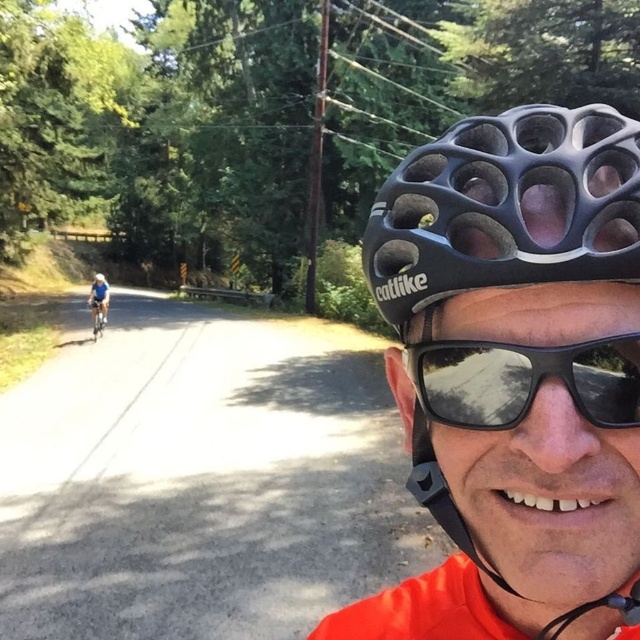
You are a delivery person who needs to park your silver metallic bicycle at center near the road. According to the scene, where exactly should you place it?

The silver metallic bicycle at center should be placed at point (97, 316) as per the coordinates provided.

You are a photographer trying to capture the person taking a selfie. You notice the black reflective sunglasses at center and the matte black helmet at center. Which object should you focus on first if you want to photograph the taller object?

The matte black helmet at center is taller than the black reflective sunglasses at center, so you should focus on the matte black helmet at center first to photograph the taller object.

You are navigating a drone along the rural road and need to fly from the point at coordinates point at [596,422] to the point at [96,276]. Based on the scene description, will the drone have to fly over the person taking the selfie or the cyclist in the midground?

The point at [596,422] is in front of the point at [96,276]. Since the drone is flying from the front point to the back point, it will have to fly over the cyclist in the midground who is further back along the road.